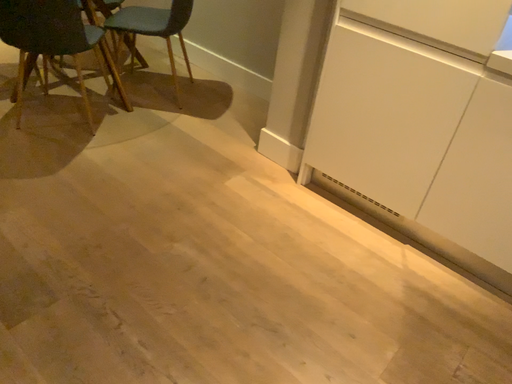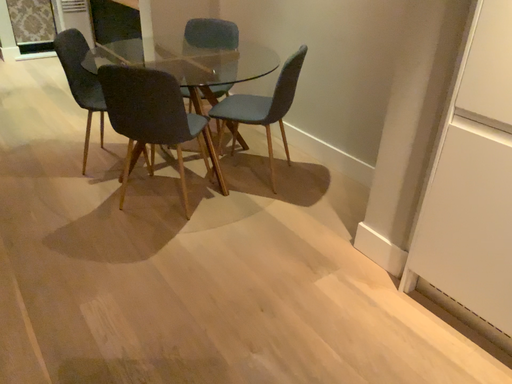
Question: How did the camera likely rotate when shooting the video?

Choices:
 (A) rotated downward
 (B) rotated upward

Answer: (B)